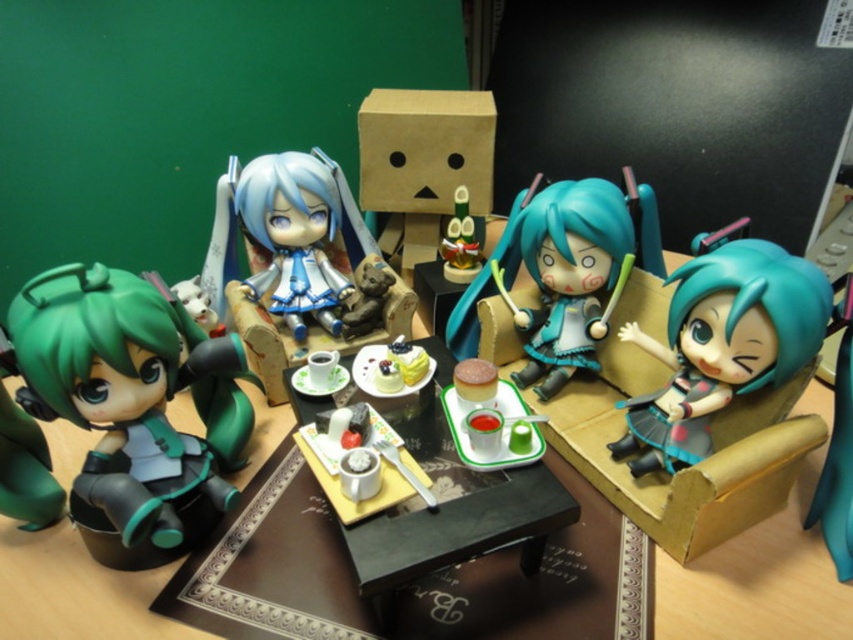
Question: Does teal glossy doll at right have a smaller size compared to white plush cat at left?

Choices:
 (A) yes
 (B) no

Answer: (B)

Question: Can you confirm if black plastic table at center is positioned below wooden duck at center?

Choices:
 (A) no
 (B) yes

Answer: (B)

Question: Is the position of matte green figure at left more distant than that of wooden duck at center?

Choices:
 (A) no
 (B) yes

Answer: (A)

Question: Which object appears farthest from the camera in this image?

Choices:
 (A) teal matte figure at center
 (B) wooden duck at center
 (C) matte blue fabric doll at center

Answer: (B)

Question: Considering the real-world distances, which object is closest to the black plastic table at center?

Choices:
 (A) white plush cat at left
 (B) teal matte figure at center
 (C) teal glossy doll at right
 (D) matte blue fabric doll at center

Answer: (B)

Question: Which of the following is the closest to the observer?

Choices:
 (A) (457, 534)
 (B) (471, 312)

Answer: (A)